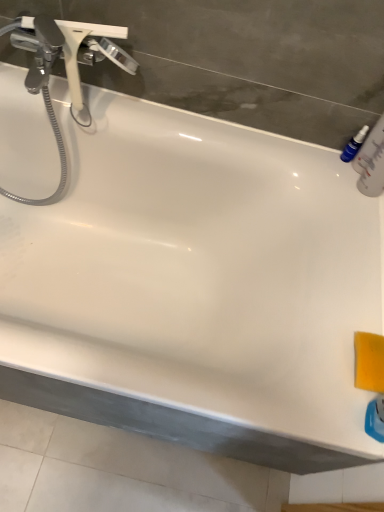
The width and height of the screenshot is (384, 512). I want to click on vacant area that is in front of blue plastic bottle at upper right, so click(x=351, y=199).